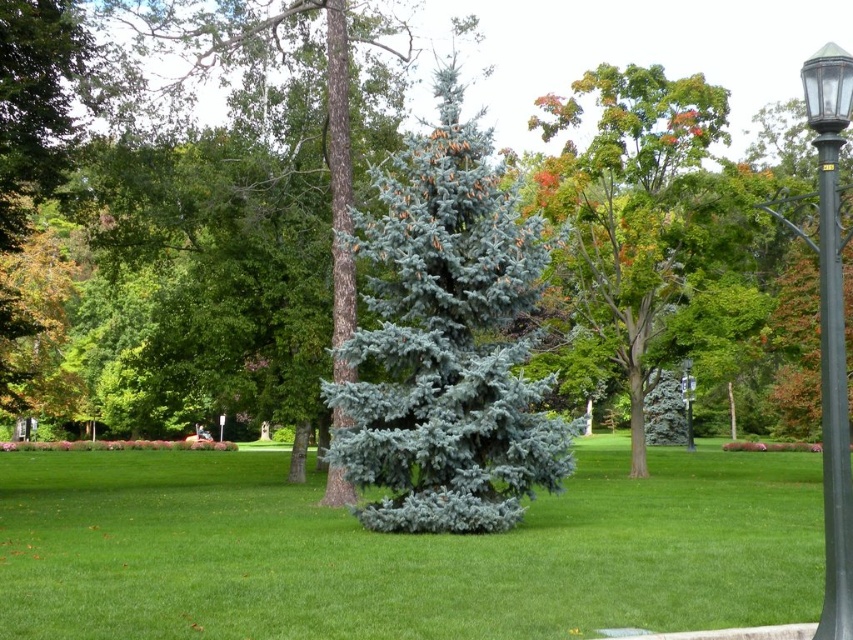
Question: Does green grass at center lie behind black glass lamp post at right?

Choices:
 (A) no
 (B) yes

Answer: (B)

Question: Does black glass lamp post at right come in front of polished metal street light at center right?

Choices:
 (A) no
 (B) yes

Answer: (B)

Question: Which is nearer to the blue-green needle-like tree at center?

Choices:
 (A) green grass at center
 (B) black glass lamp post at right

Answer: (A)

Question: Which object appears farthest from the camera in this image?

Choices:
 (A) black glass lamp post at right
 (B) polished metal street light at center right

Answer: (B)

Question: Among these points, which one is farthest from the camera?

Choices:
 (A) (830, 204)
 (B) (450, 506)

Answer: (B)

Question: Is blue-green needle-like tree at center thinner than black metal street light at right?

Choices:
 (A) yes
 (B) no

Answer: (A)